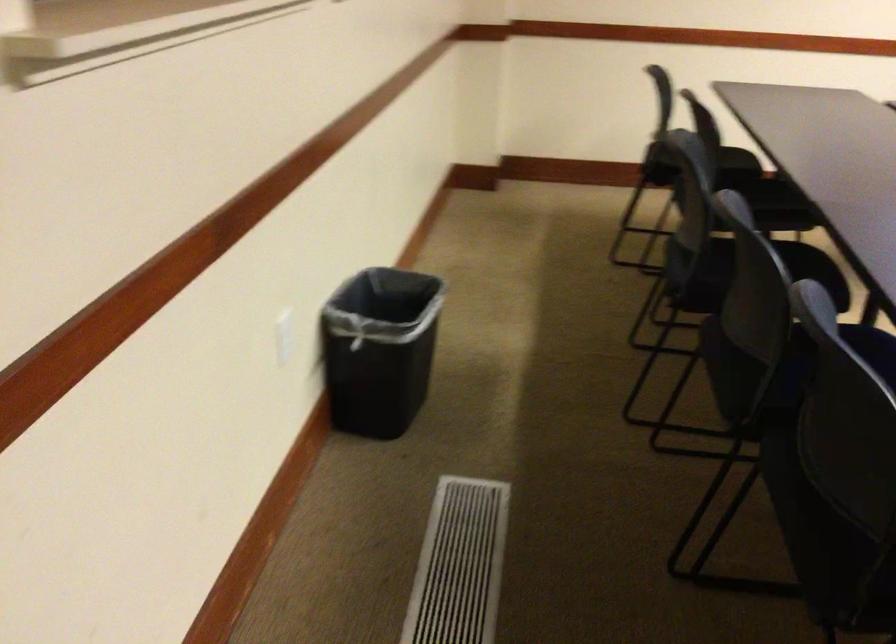
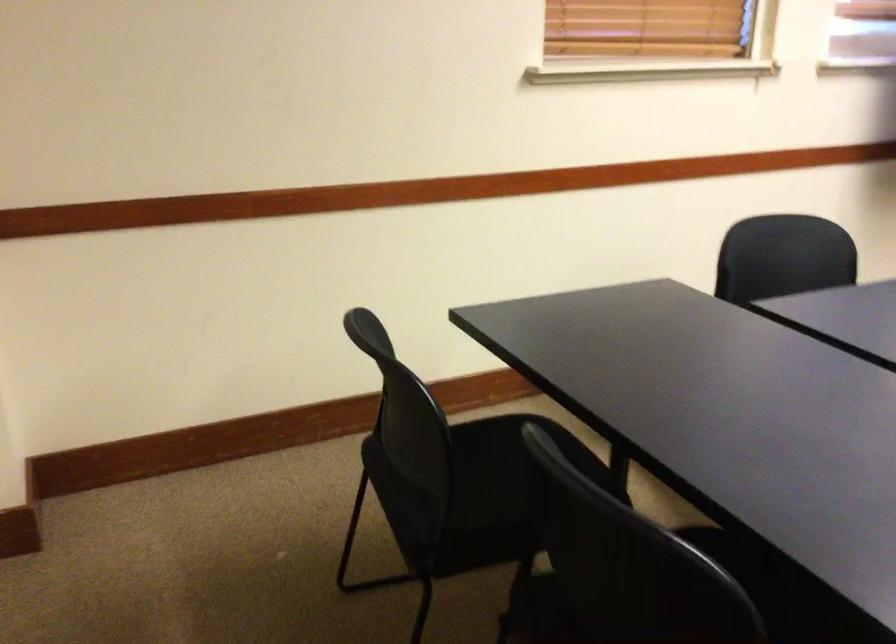
Question: What movement of the cameraman would produce the second image?

Choices:
 (A) Left
 (B) Right
 (C) Forward
 (D) Backward

Answer: (D)